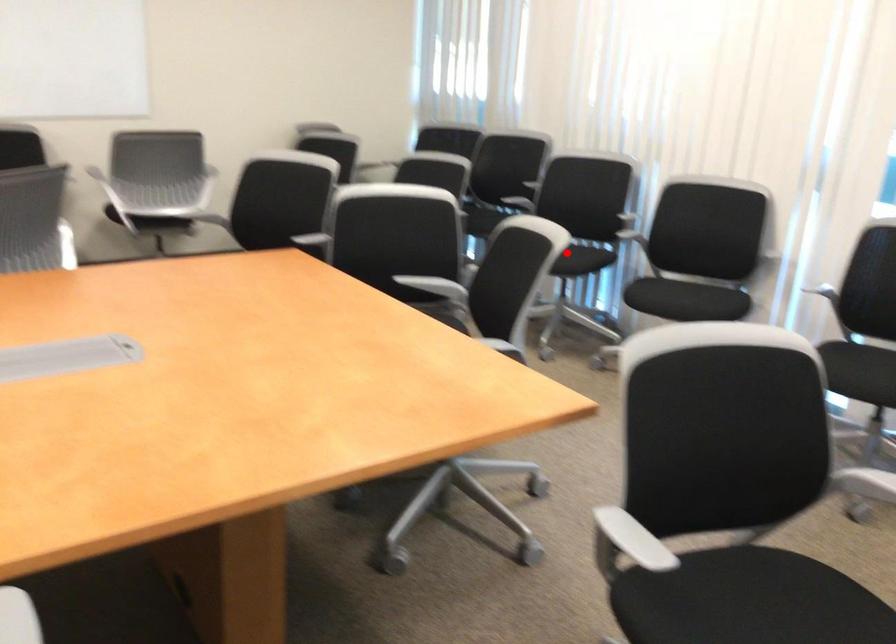
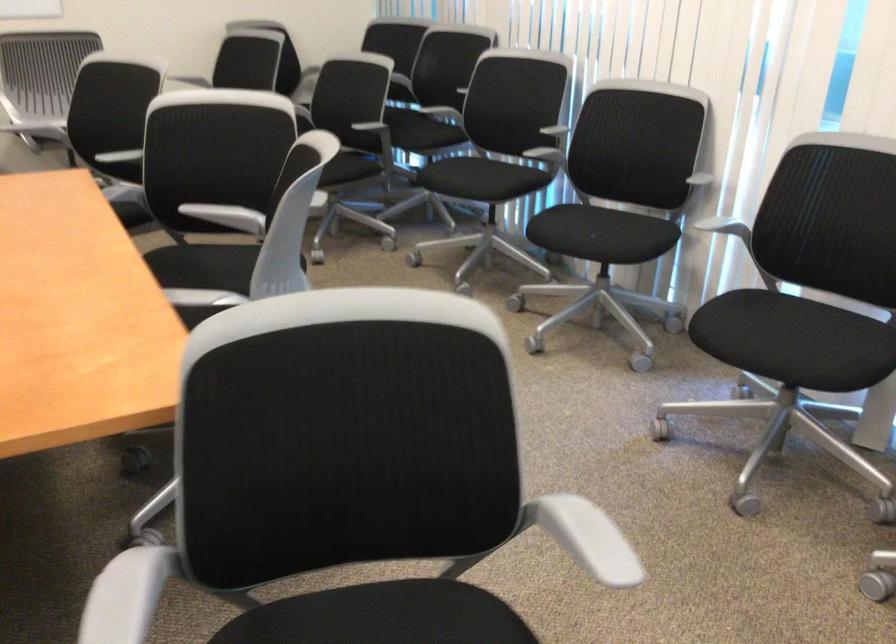
In the second image, find the point that corresponds to the highlighted location in the first image.

(480, 178)